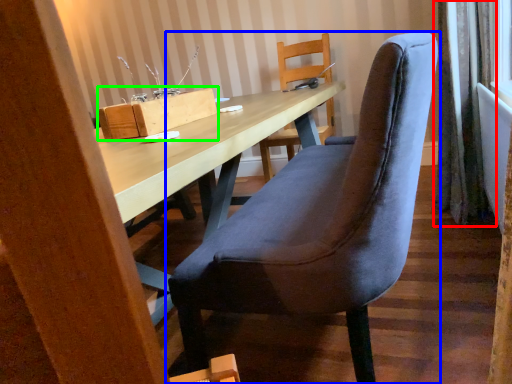
Question: Which object is positioned farthest from curtain (highlighted by a red box)? Select from chair (highlighted by a blue box) and cardboard box (highlighted by a green box).

Choices:
 (A) chair
 (B) cardboard box

Answer: (B)